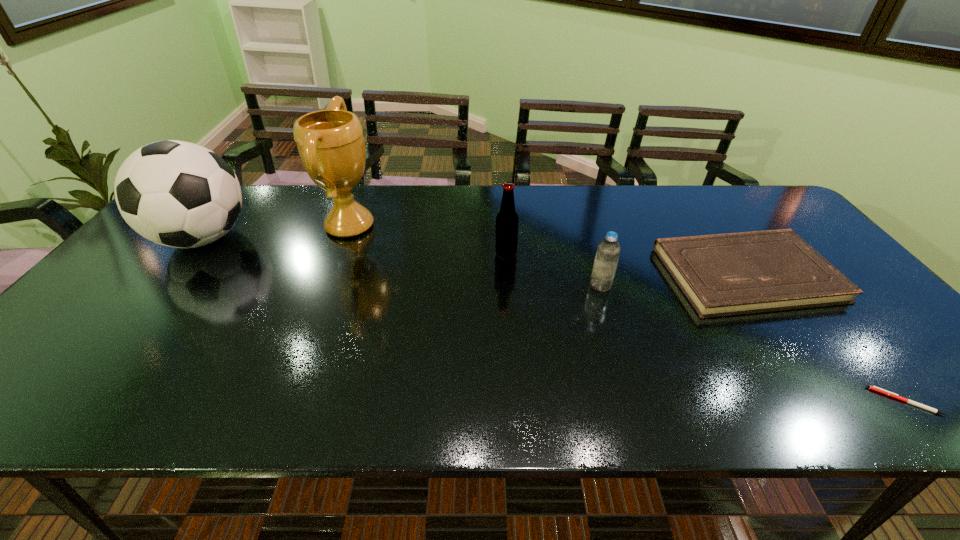
This screenshot has height=540, width=960. In order to click on the fifth object from right to left in this screenshot , I will do `click(330, 142)`.

Identify the location of award. Image resolution: width=960 pixels, height=540 pixels. (330, 142).

I want to click on the leftmost object, so click(178, 194).

Find the location of a particular element. This screenshot has width=960, height=540. soccer ball is located at coordinates (178, 194).

This screenshot has height=540, width=960. I want to click on the fourth object from right to left, so click(x=507, y=221).

You are a GUI agent. You are given a task and a screenshot of the screen. Output one action in this format:
    pyautogui.click(x=<x>, y=<y>)
    Task: Click on the fourth shortest object
    
    Given the screenshot: What is the action you would take?
    pyautogui.click(x=507, y=221)

Identify the location of water bottle. (608, 251).

Identify the location of the third shortest object. (608, 251).

You are a GUI agent. You are given a task and a screenshot of the screen. Output one action in this format:
    pyautogui.click(x=<x>, y=<y>)
    Task: Click on the paperback book
    
    Given the screenshot: What is the action you would take?
    727,274

This screenshot has height=540, width=960. Find the location of `pen`. pen is located at coordinates (874, 388).